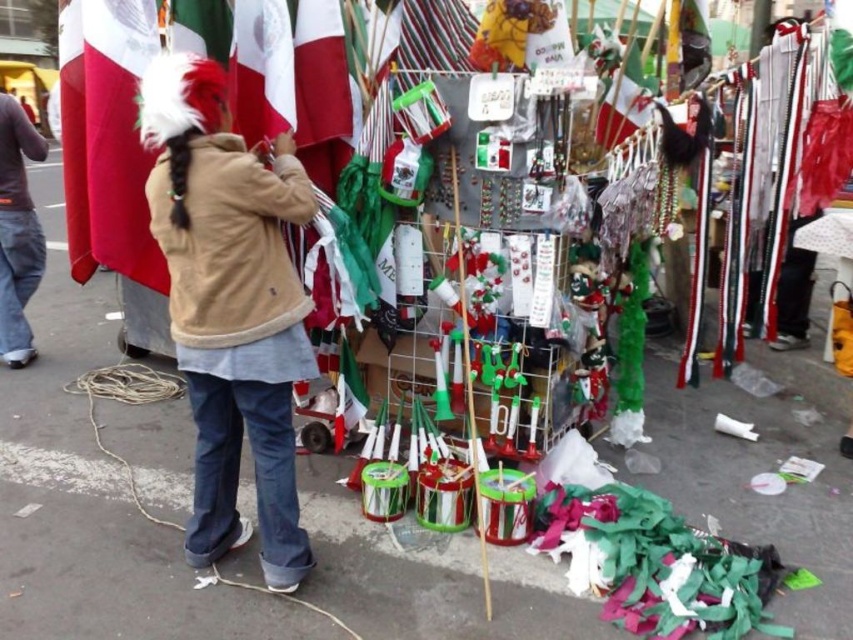
Who is positioned more to the right, red felt flag at upper left or matte green flag at upper center?

matte green flag at upper center

Consider the image. Is red felt flag at upper left below matte green flag at upper center?

Indeed, red felt flag at upper left is positioned under matte green flag at upper center.

Is point (141, 173) positioned before point (606, 109)?

Yes.

Find the location of a particular element. The height and width of the screenshot is (640, 853). red felt flag at upper left is located at coordinates (119, 136).

This screenshot has height=640, width=853. What are the coordinates of `beige fleece jacket at center` in the screenshot? It's located at (230, 243).

Is point (248, 189) positioned behind point (128, 67)?

No, (248, 189) is in front of (128, 67).

At what (x,y) coordinates should I click in order to perform the action: click on beige fleece jacket at center. Please return your answer as a coordinate pair (x, y). The width and height of the screenshot is (853, 640). Looking at the image, I should click on (230, 243).

Which is behind, point (13, 243) or point (252, 134)?

Point (13, 243)

Can you confirm if denim jeans at left is thinner than white fabric flag at upper left?

Incorrect, denim jeans at left's width is not less than white fabric flag at upper left's.

What do you see at coordinates (16, 232) in the screenshot? I see `denim jeans at left` at bounding box center [16, 232].

Where is `denim jeans at left`? denim jeans at left is located at coordinates (16, 232).